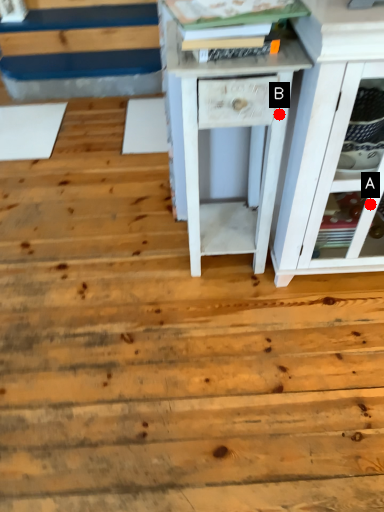
Question: Two points are circled on the image, labeled by A and B beside each circle. Which of the following is the closest to the observer?

Choices:
 (A) A is closer
 (B) B is closer

Answer: (B)